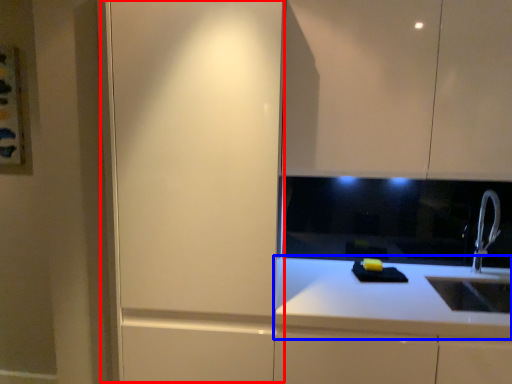
Question: Which object is further to the camera taking this photo, screen door (highlighted by a red box) or countertop (highlighted by a blue box)?

Choices:
 (A) screen door
 (B) countertop

Answer: (B)